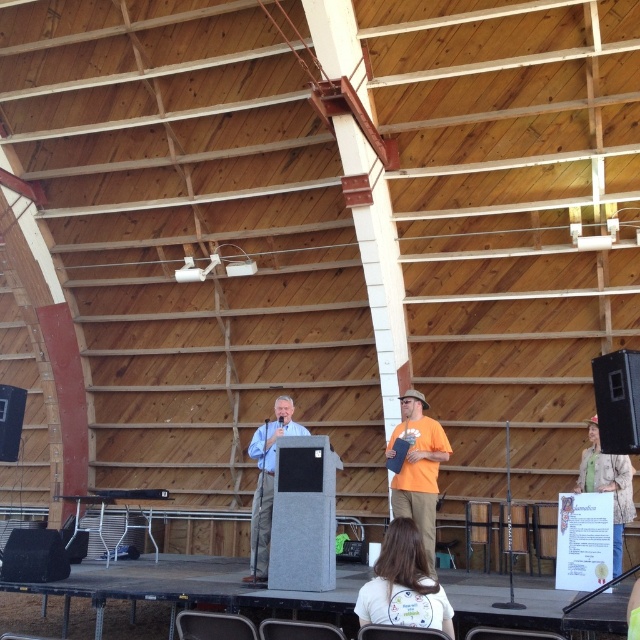
Question: Which of the following is the farthest from the observer?

Choices:
 (A) (618, 518)
 (B) (435, 627)
 (C) (620, 420)
 (D) (396, 438)

Answer: (A)

Question: Which of the following is the farthest from the observer?

Choices:
 (A) white fabric at lower center
 (B) matte black speaker at center
 (C) orange cotton shirt at center
 (D) green textured sweater at lower right

Answer: (D)

Question: Is orange cotton shirt at center to the left of matte blue shirt at center from the viewer's perspective?

Choices:
 (A) no
 (B) yes

Answer: (A)

Question: Is white fabric at lower center smaller than matte black speaker at center?

Choices:
 (A) no
 (B) yes

Answer: (A)

Question: Can you confirm if white fabric at lower center is thinner than orange cotton shirt at center?

Choices:
 (A) no
 (B) yes

Answer: (B)

Question: Which object appears farthest from the camera in this image?

Choices:
 (A) matte black speaker at center
 (B) orange cotton shirt at center
 (C) matte blue shirt at center
 (D) green textured sweater at lower right

Answer: (C)